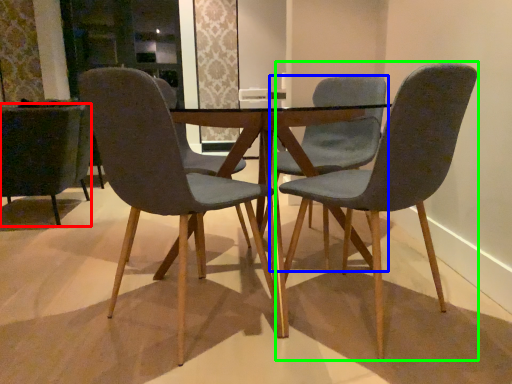
Question: Based on their relative distances, which object is farther from chair (highlighted by a red box)? Choose from chair (highlighted by a blue box) and chair (highlighted by a green box).

Choices:
 (A) chair
 (B) chair

Answer: (B)